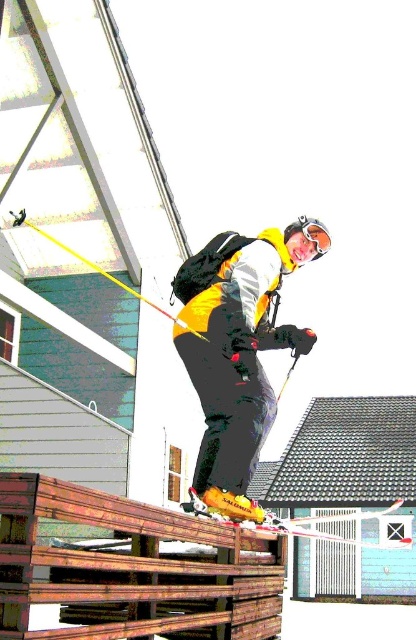
Question: Considering the real-world distances, which object is farthest from the rusty wood rail at center?

Choices:
 (A) yellow matte ski at center
 (B) translucent orange goggles at upper center
 (C) yellow metallic ski at center

Answer: (B)

Question: Can you confirm if rusty wood rail at center is positioned above yellow matte ski at center?

Choices:
 (A) yes
 (B) no

Answer: (B)

Question: Is rusty wood rail at center closer to the viewer compared to yellow plastic ski pole at upper center?

Choices:
 (A) yes
 (B) no

Answer: (A)

Question: Can you confirm if yellow matte ski at center is wider than yellow plastic ski pole at upper center?

Choices:
 (A) yes
 (B) no

Answer: (B)

Question: Which object is the farthest from the translucent orange goggles at upper center?

Choices:
 (A) rusty wood rail at center
 (B) yellow matte ski at center
 (C) yellow plastic ski pole at upper center

Answer: (A)

Question: Which of the following is the farthest from the observer?

Choices:
 (A) yellow matte ski at center
 (B) yellow plastic ski pole at upper center
 (C) rusty wood rail at center
 (D) yellow metallic ski at center

Answer: (A)